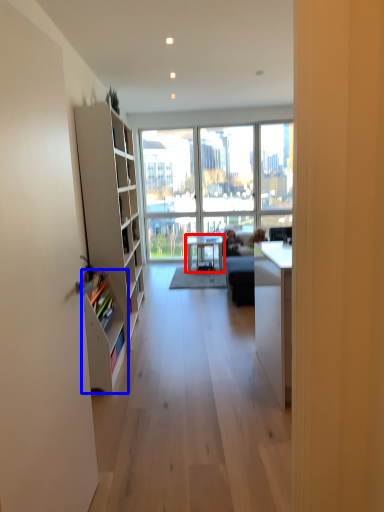
Question: Which point is closer to the camera, table (highlighted by a red box) or shelf (highlighted by a blue box)?

Choices:
 (A) table
 (B) shelf

Answer: (B)